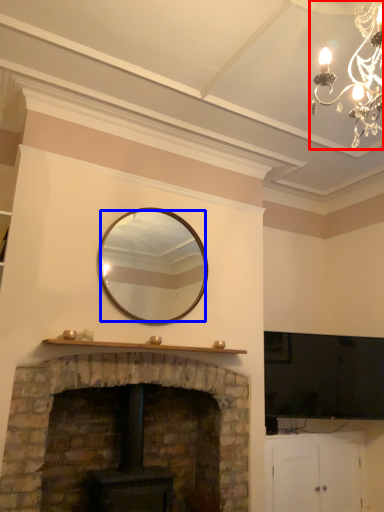
Question: Which of the following is the farthest to the observer, lamp (highlighted by a red box) or mirror (highlighted by a blue box)?

Choices:
 (A) lamp
 (B) mirror

Answer: (B)